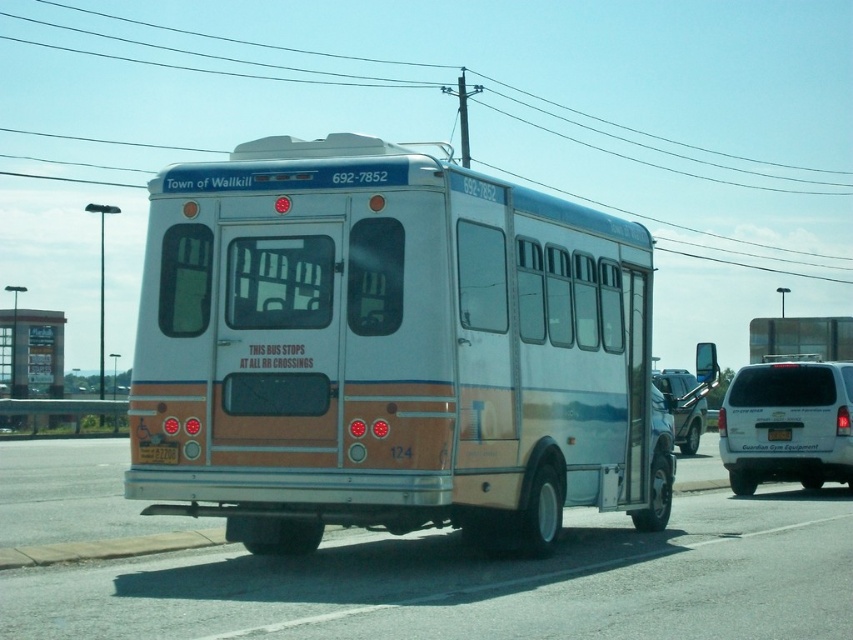
Between white matte van at right and yellow plastic license plate at rear center, which one appears on the right side from the viewer's perspective?

white matte van at right is more to the right.

Is white matte van at right wider than yellow plastic license plate at rear center?

Yes.

Find the location of a particular element. white matte van at right is located at coordinates (787, 424).

Locate an element on the screen. This screenshot has width=853, height=640. white matte van at right is located at coordinates (787, 424).

Can you confirm if white metallic bus at center is thinner than metallic silver suv at right?

Yes.

Is the position of white metallic bus at center less distant than that of metallic silver suv at right?

Yes.

Is point (502, 298) farther from camera compared to point (705, 400)?

No, (502, 298) is closer to viewer.

At what (x,y) coordinates should I click in order to perform the action: click on white metallic bus at center. Please return your answer as a coordinate pair (x, y). This screenshot has height=640, width=853. Looking at the image, I should click on (389, 349).

Between white matte van at right and black plastic license plate at rear, which one appears on the left side from the viewer's perspective?

white matte van at right

Is white matte van at right in front of black plastic license plate at rear?

No, white matte van at right is behind black plastic license plate at rear.

Measure the distance between white matte van at right and camera.

white matte van at right and camera are 16.72 meters apart.

Where is `white matte van at right`? The image size is (853, 640). white matte van at right is located at coordinates (787, 424).